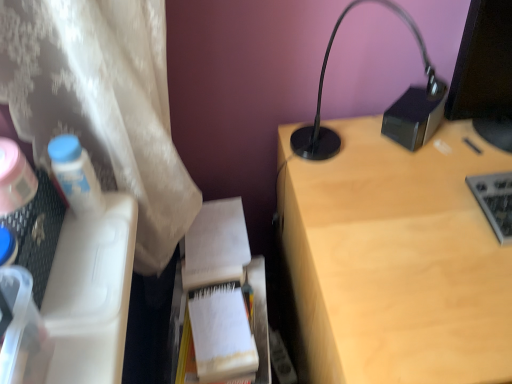
You are a GUI agent. You are given a task and a screenshot of the screen. Output one action in this format:
    pyautogui.click(x=<x>, y=<y>)
    Task: Click on the free space to the left of black matte speaker at upper right
    
    Given the screenshot: What is the action you would take?
    click(x=340, y=141)